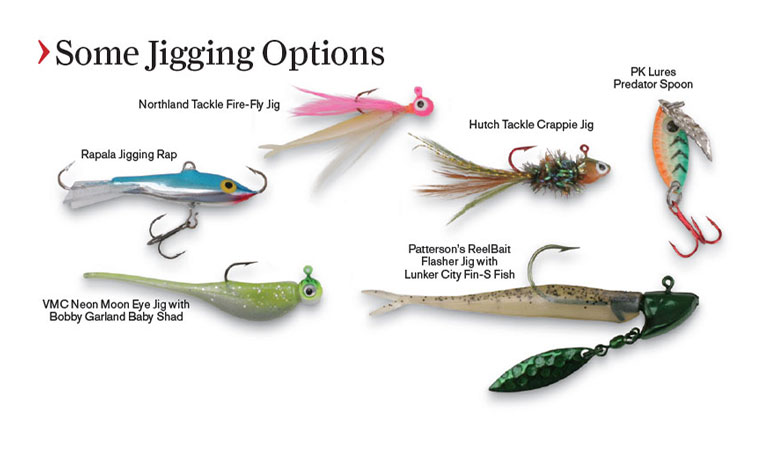
I want to click on multi point hooks, so click(158, 238), click(695, 235).